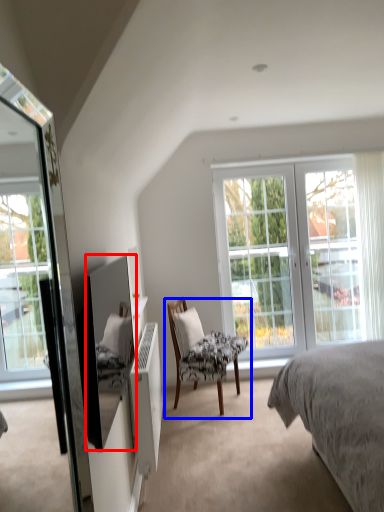
Question: Which point is further to the camera, mirror (highlighted by a red box) or chair (highlighted by a blue box)?

Choices:
 (A) mirror
 (B) chair

Answer: (B)